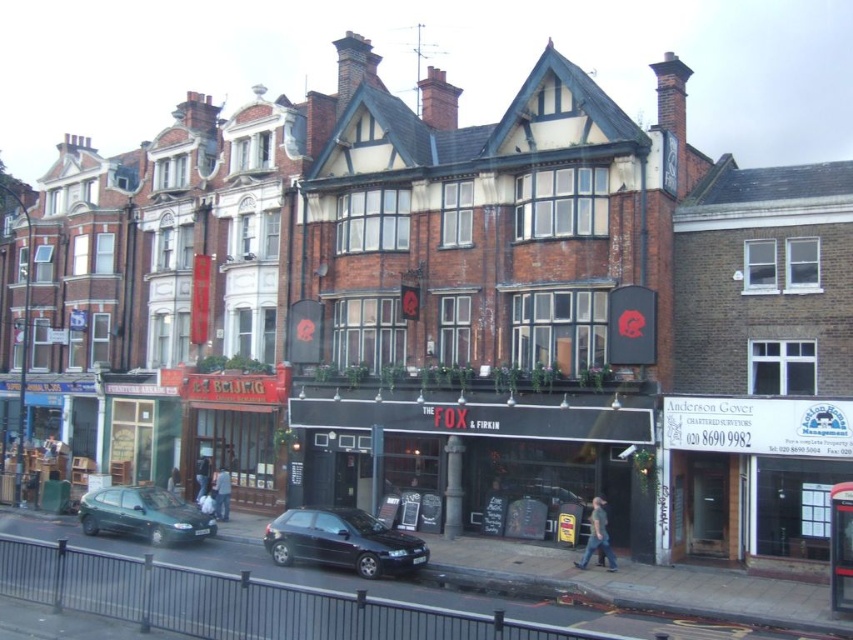
Is shiny black car at center below metallic green hatchback at lower left?

Correct, shiny black car at center is located below metallic green hatchback at lower left.

Is shiny black car at center positioned in front of metallic green hatchback at lower left?

Yes.

In order to click on shiny black car at center in this screenshot , I will do `click(343, 541)`.

Image resolution: width=853 pixels, height=640 pixels. What do you see at coordinates (492, 456) in the screenshot?
I see `black matte signboard at center` at bounding box center [492, 456].

Can you confirm if black matte signboard at center is positioned below metallic green hatchback at lower left?

Incorrect, black matte signboard at center is not positioned below metallic green hatchback at lower left.

Between point (347, 396) and point (134, 486), which one is positioned in front?

Positioned in front is point (134, 486).

Locate an element on the screen. The image size is (853, 640). black matte signboard at center is located at coordinates (492, 456).

Which of these two, black matte signboard at center or shiny black car at center, stands taller?

Standing taller between the two is black matte signboard at center.

Which is more to the right, black matte signboard at center or shiny black car at center?

black matte signboard at center

Image resolution: width=853 pixels, height=640 pixels. Describe the element at coordinates (492, 456) in the screenshot. I see `black matte signboard at center` at that location.

The height and width of the screenshot is (640, 853). Identify the location of black matte signboard at center. point(492,456).